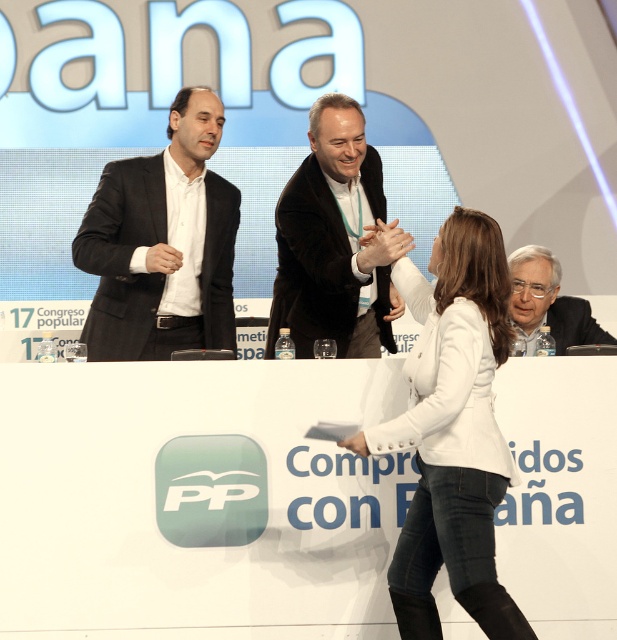
Does matte black hand at center appear on the right side of matte black suit at upper left?

Yes, matte black hand at center is to the right of matte black suit at upper left.

Is point (383, 225) farther from viewer compared to point (162, 268)?

No, it is not.

The height and width of the screenshot is (640, 617). In order to click on matte black hand at center in this screenshot , I will do `click(383, 244)`.

Who is lower down, velvet black suit at center or matte black suit at upper left?

matte black suit at upper left is below.

Which of these two, velvet black suit at center or matte black suit at upper left, stands taller?

velvet black suit at center is taller.

Is point (312, 124) farther from viewer compared to point (162, 248)?

That is True.

This screenshot has width=617, height=640. In order to click on velvet black suit at center in this screenshot , I will do `click(334, 241)`.

Is point (358, 192) farther from viewer compared to point (565, 336)?

That is False.

Measure the distance from velvet black suit at center to white textured suit at lower right.

The distance of velvet black suit at center from white textured suit at lower right is 1.09 meters.

What do you see at coordinates (334, 241) in the screenshot? The width and height of the screenshot is (617, 640). I see `velvet black suit at center` at bounding box center [334, 241].

I want to click on velvet black suit at center, so click(334, 241).